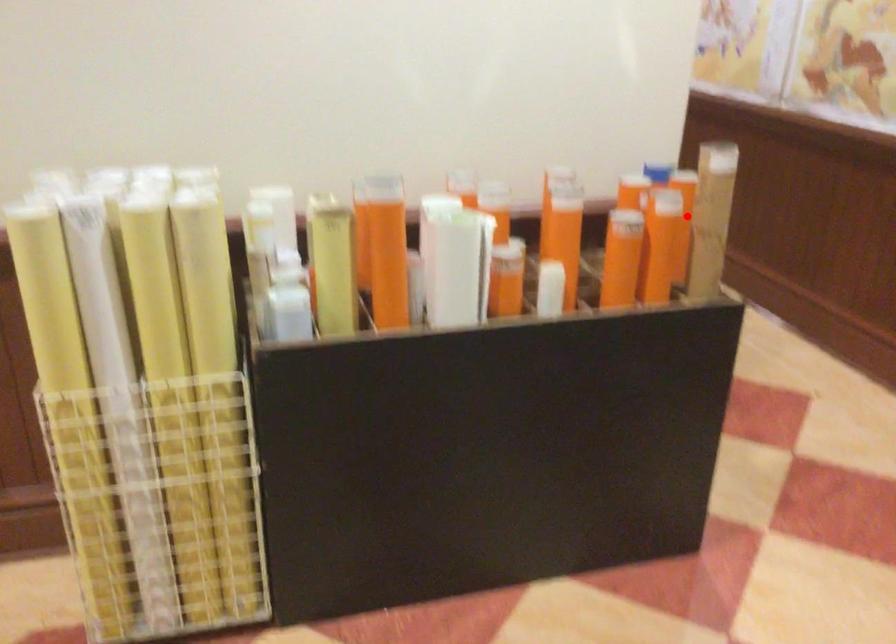
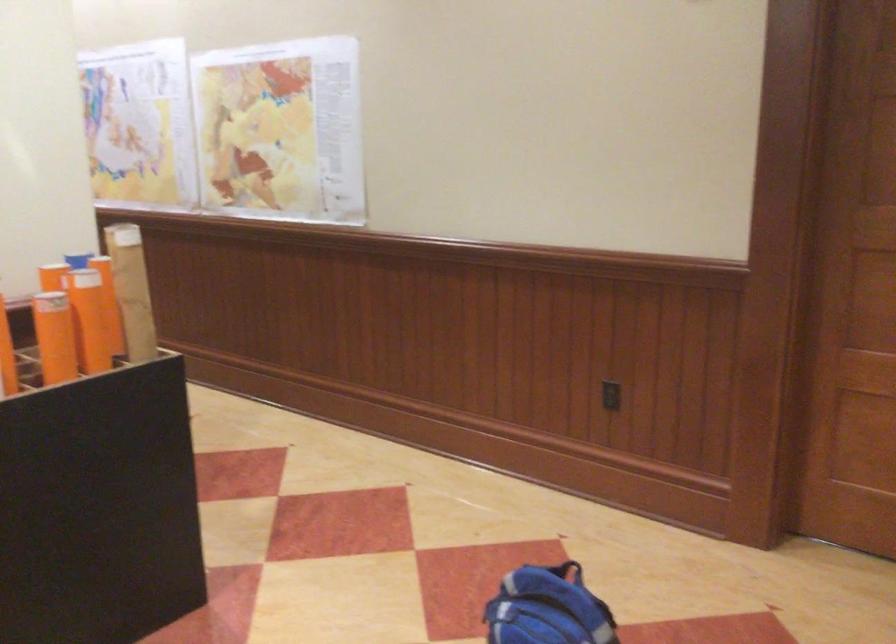
Question: I am providing you with two images of the same scene from different viewpoints. A red point is marked on the first image. At the location where the point appears in image 1, is it still visible in image 2?

Choices:
 (A) Yes
 (B) No

Answer: (A)